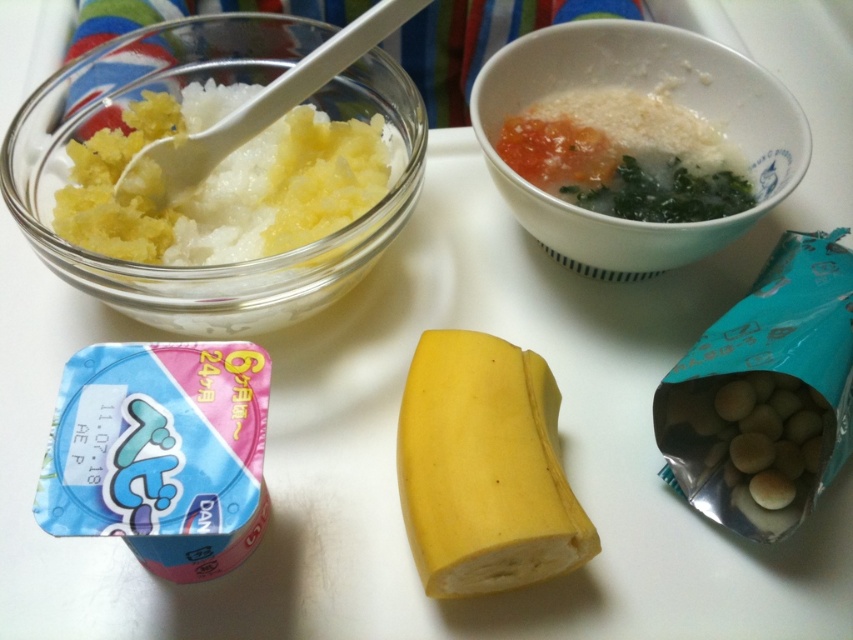
You are a parent preparing a meal for your child. You have two bowls on the table. The translucent glass bowl at upper left and the white matte bowl at upper right. You want to choose the bowl that is taller to hold a thicker puree that needs to be stirred frequently. Which bowl should you choose?

The translucent glass bowl at upper left is much taller than the white matte bowl at upper right, so you should choose the translucent glass bowl at upper left to hold the thicker puree that needs to be stirred frequently.

You are holding a toy airplane that is 12 inches long. You want to place it on the table so that it points towards the point at coordinates point (550, 476). Can the entire airplane fit on the table without any part hanging off the edge?

The point at coordinates point (550, 476) is 15.00 inches away from the viewer. Since the airplane is 12 inches long, placing it towards that point would leave 3 inches of space between the airplane and the edge of the table. Therefore, the entire airplane can fit on the table without any part hanging off the edge.